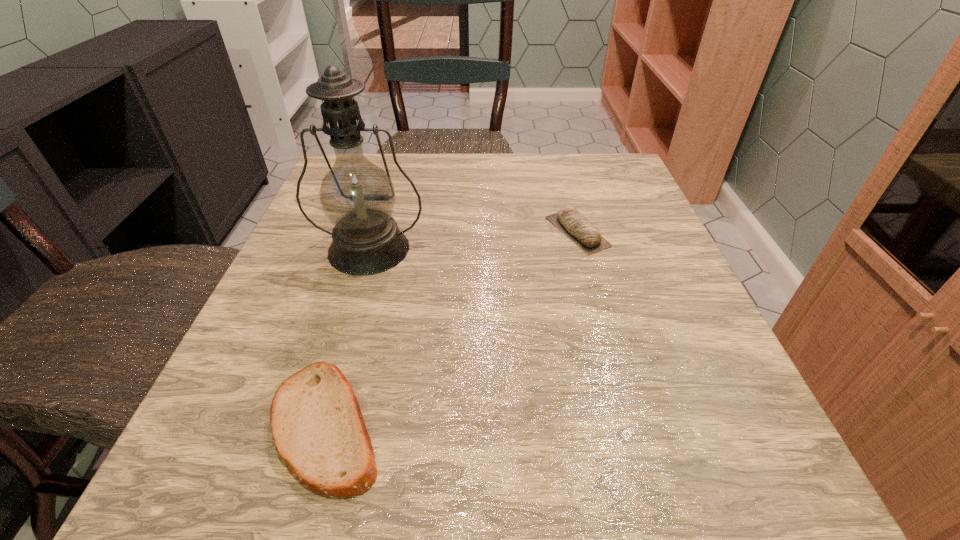
Where is `pita bread that is at the left edge`? pita bread that is at the left edge is located at coordinates (317, 426).

At what (x,y) coordinates should I click in order to perform the action: click on object that is positioned at the right edge. Please return your answer as a coordinate pair (x, y). Image resolution: width=960 pixels, height=540 pixels. Looking at the image, I should click on (575, 226).

Identify the location of object that is at the near left corner. (317, 426).

Identify the location of vacant space at the far edge. (451, 156).

Locate an element on the screen. vacant area at the near edge of the desktop is located at coordinates (503, 469).

In the image, there is a desktop. Identify the location of vacant space at the left edge. The width and height of the screenshot is (960, 540). (319, 266).

At what (x,y) coordinates should I click in order to perform the action: click on vacant space at the right edge of the desktop. Please return your answer as a coordinate pair (x, y). Image resolution: width=960 pixels, height=540 pixels. Looking at the image, I should click on (644, 362).

In order to click on vacant space at the far left corner of the desktop in this screenshot , I will do `click(330, 170)`.

In order to click on vacant space at the far right corner of the desktop in this screenshot , I will do `click(597, 161)`.

Identify the location of vacant point located between the tallest object and the rightmost object. The image size is (960, 540). (473, 240).